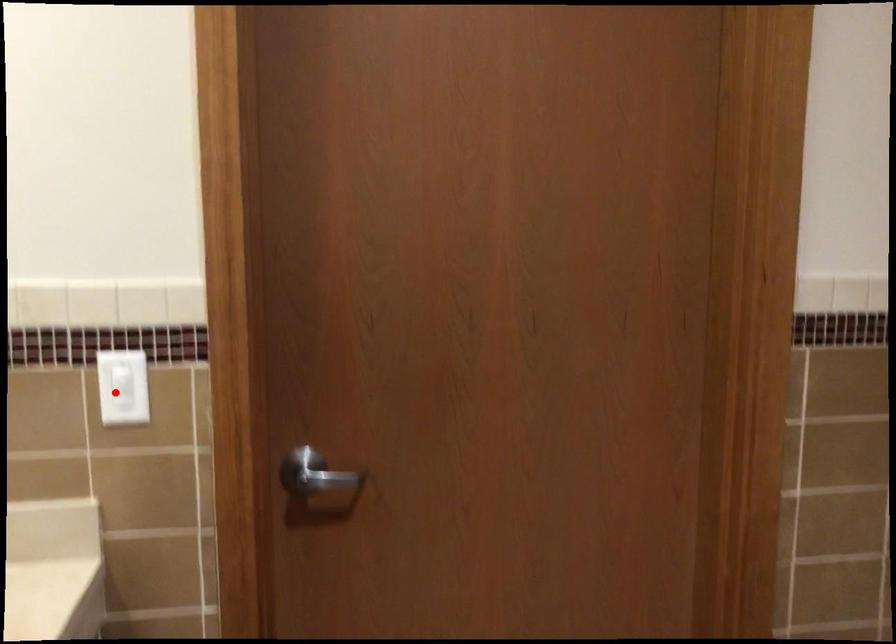
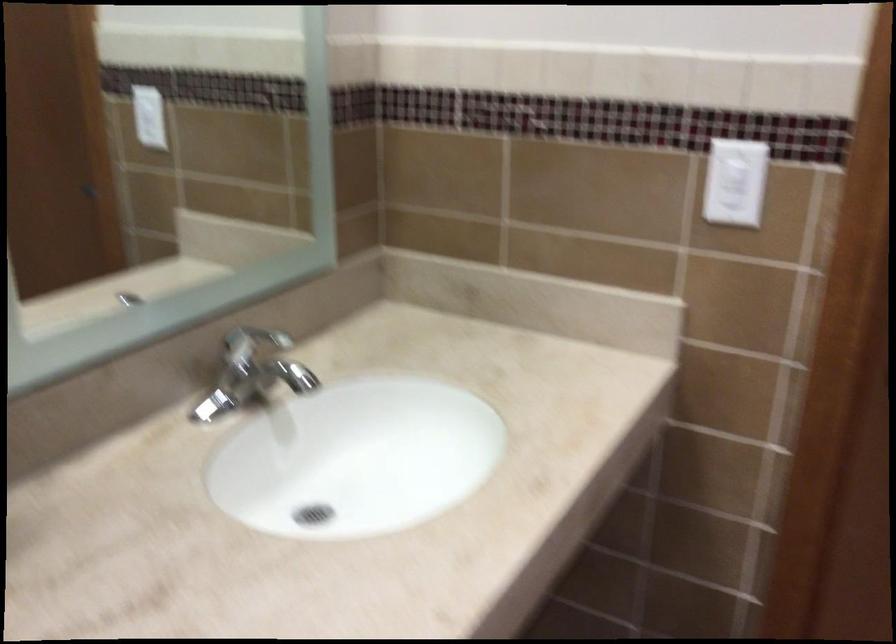
Question: A red point is marked in image1. In image2, is the corresponding 3D point closer to the camera or farther? Reply with the corresponding letter.

Choices:
 (A) The corresponding 3D point is closer.
 (B) The corresponding 3D point is farther.

Answer: (A)